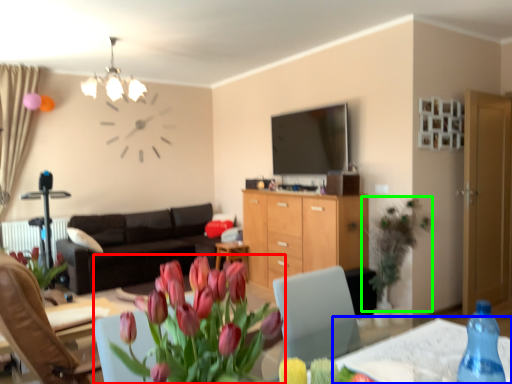
Question: Estimate the real-world distances between objects in this image. Which object is closer to houseplant (highlighted by a red box), round table (highlighted by a blue box) or floral arrangement (highlighted by a green box)?

Choices:
 (A) round table
 (B) floral arrangement

Answer: (A)